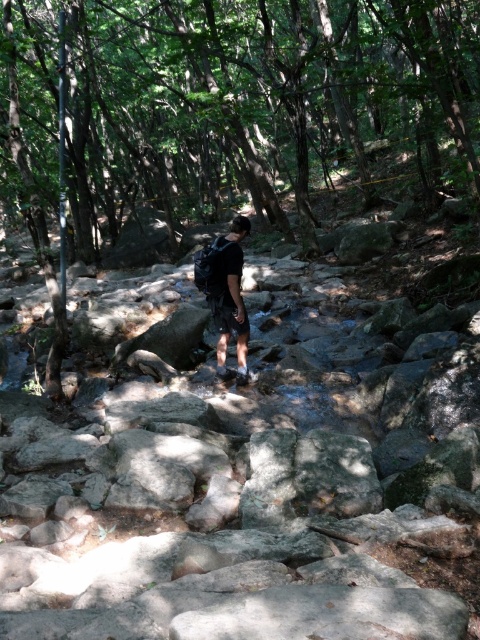
From the picture: Who is higher up, green leafy tree at center or dark gray backpack at center?

green leafy tree at center

Is green leafy tree at center taller than dark gray backpack at center?

Correct, green leafy tree at center is much taller as dark gray backpack at center.

What do you see at coordinates (228, 109) in the screenshot?
I see `green leafy tree at center` at bounding box center [228, 109].

This screenshot has width=480, height=640. I want to click on green leafy tree at center, so click(x=228, y=109).